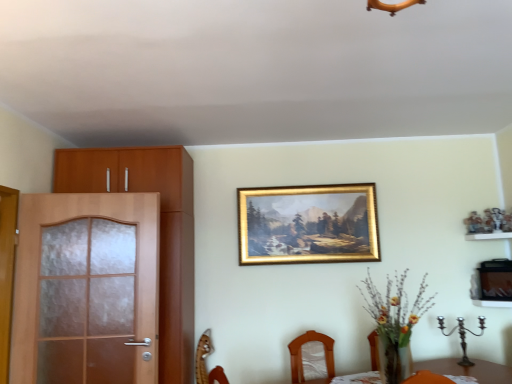
Question: Is wooden shelf at right to the left of matte wood cabinet at left from the viewer's perspective?

Choices:
 (A) no
 (B) yes

Answer: (A)

Question: Is matte wood cabinet at left surrounded by wooden shelf at right?

Choices:
 (A) no
 (B) yes

Answer: (A)

Question: Does wooden shelf at right have a larger size compared to matte wood cabinet at left?

Choices:
 (A) yes
 (B) no

Answer: (B)

Question: Is wooden shelf at right positioned behind matte wood cabinet at left?

Choices:
 (A) yes
 (B) no

Answer: (A)

Question: Are wooden shelf at right and matte wood cabinet at left making contact?

Choices:
 (A) no
 (B) yes

Answer: (A)

Question: Is point (183, 153) closer or farther from the camera than point (505, 231)?

Choices:
 (A) closer
 (B) farther

Answer: (A)

Question: Considering their positions, is matte wood cabinet at left located in front of or behind wooden shelf at right?

Choices:
 (A) front
 (B) behind

Answer: (A)

Question: From a real-world perspective, is matte wood cabinet at left positioned above or below wooden shelf at right?

Choices:
 (A) below
 (B) above

Answer: (A)

Question: Visually, is matte wood cabinet at left positioned to the left or to the right of wooden shelf at right?

Choices:
 (A) right
 (B) left

Answer: (B)

Question: Choose the correct answer: Is matte wood cabinet at left inside brown matte screen door at left or outside it?

Choices:
 (A) inside
 (B) outside

Answer: (B)

Question: From their relative heights in the image, would you say matte wood cabinet at left is taller or shorter than brown matte screen door at left?

Choices:
 (A) tall
 (B) short

Answer: (A)

Question: Considering the positions of matte wood cabinet at left and brown matte screen door at left in the image, is matte wood cabinet at left wider or thinner than brown matte screen door at left?

Choices:
 (A) wide
 (B) thin

Answer: (A)

Question: In the image, is matte wood cabinet at left positioned in front of or behind brown matte screen door at left?

Choices:
 (A) front
 (B) behind

Answer: (B)

Question: From the image's perspective, is matte wood cabinet at left located above or below wooden chair at lower center?

Choices:
 (A) above
 (B) below

Answer: (A)

Question: Looking at the image, does matte wood cabinet at left seem bigger or smaller compared to wooden chair at lower center?

Choices:
 (A) small
 (B) big

Answer: (B)